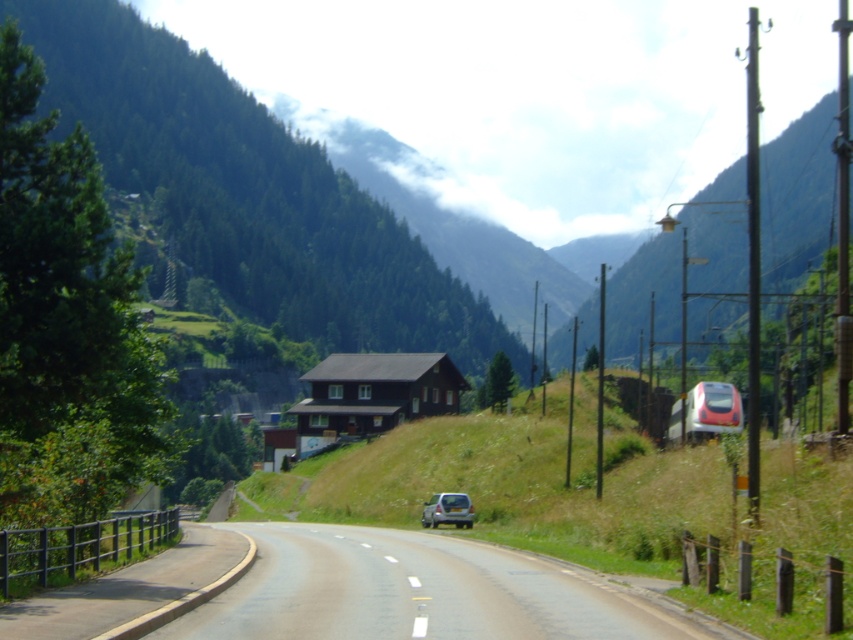
Question: Which point is farther to the camera?

Choices:
 (A) (225, 552)
 (B) (451, 497)

Answer: (B)

Question: Which of the following is the closest to the observer?

Choices:
 (A) [440, 499]
 (B) [235, 563]

Answer: (B)

Question: Can you confirm if smooth asphalt road at center is positioned above silver metallic suv at center?

Choices:
 (A) yes
 (B) no

Answer: (A)

Question: Is smooth asphalt road at center closer to the viewer compared to silver metallic suv at center?

Choices:
 (A) no
 (B) yes

Answer: (B)

Question: Which object appears closest to the camera in this image?

Choices:
 (A) silver metallic suv at center
 (B) smooth asphalt road at center

Answer: (B)

Question: Is smooth asphalt road at center below silver metallic suv at center?

Choices:
 (A) no
 (B) yes

Answer: (A)